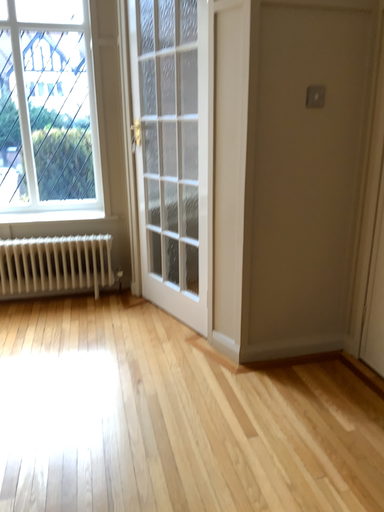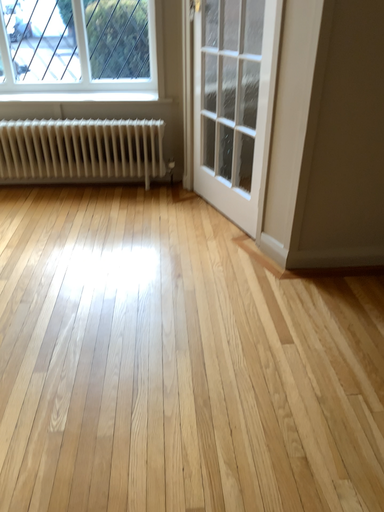
Question: How did the camera likely rotate when shooting the video?

Choices:
 (A) rotated upward
 (B) rotated downward

Answer: (B)